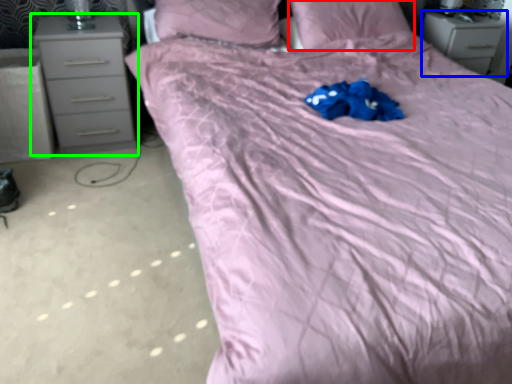
Question: Which is nearer to the pillow (highlighted by a red box)? chest of drawers (highlighted by a blue box) or chest of drawers (highlighted by a green box).

Choices:
 (A) chest of drawers
 (B) chest of drawers

Answer: (A)